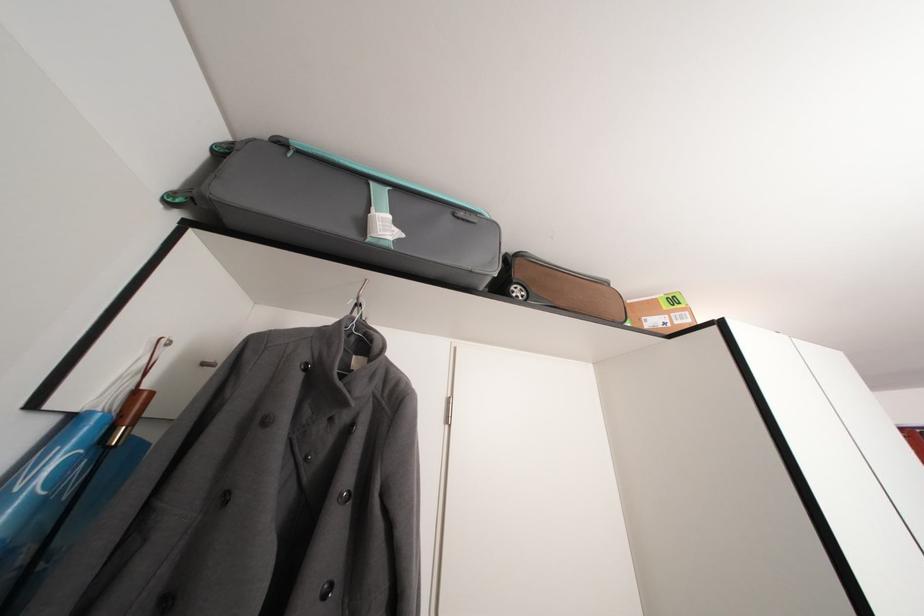
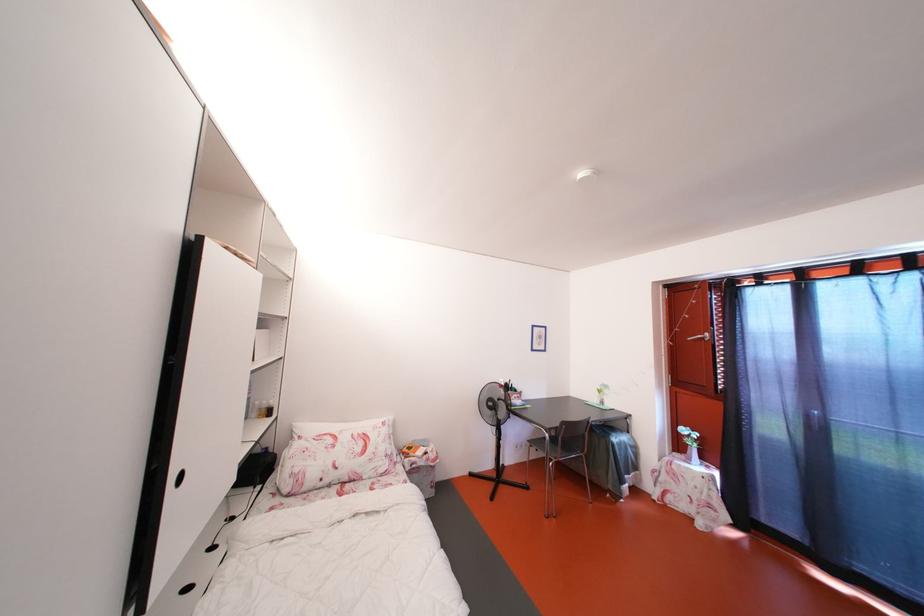
Question: Which direction would the cameraman need to move to produce the second image? Reply with the corresponding letter.

Choices:
 (A) Left
 (B) Right
 (C) Forward
 (D) Backward

Answer: (B)